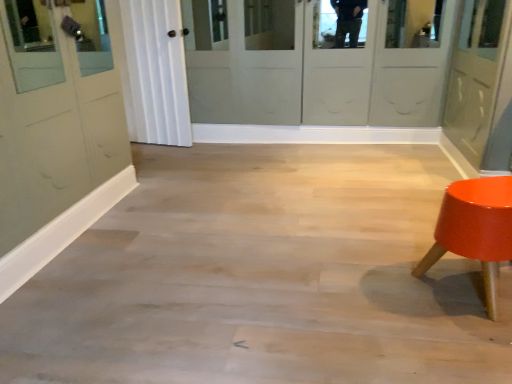
The width and height of the screenshot is (512, 384). Identify the location of vacant region above shiny orange stool at right (from a real-world perspective). (485, 193).